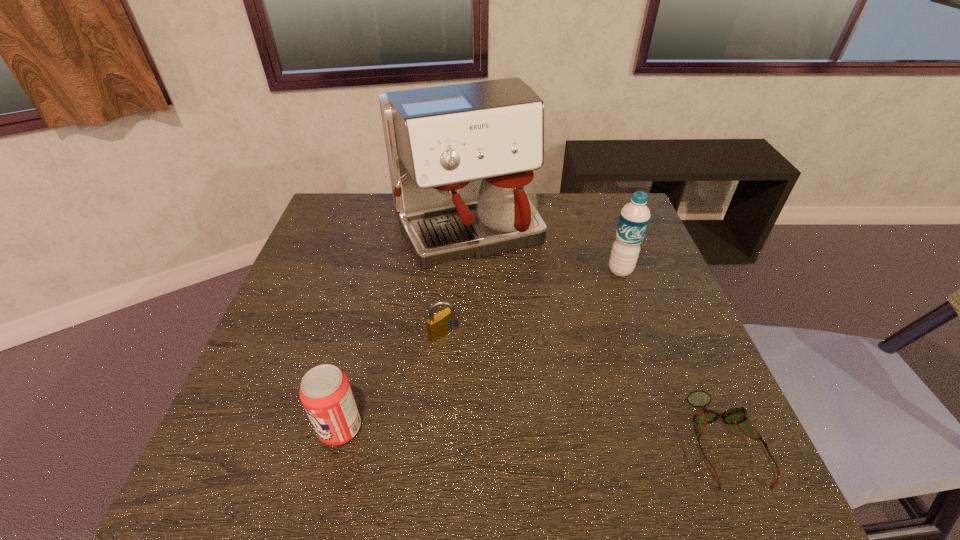
Identify the location of vacant spot on the desktop that is between the third shortest object and the shortest object and is positioned on the label of the fourth shortest object. Image resolution: width=960 pixels, height=540 pixels. (557, 436).

Where is `vacant space on the desktop that is between the soda can and the spectacles and is positioned on the side with the combination dials of the second shortest object`? vacant space on the desktop that is between the soda can and the spectacles and is positioned on the side with the combination dials of the second shortest object is located at coordinates (556, 436).

This screenshot has width=960, height=540. What are the coordinates of `vacant spot on the desktop that is between the third tallest object and the spectacles and is positioned on the front of the coffee maker near the spout` in the screenshot? It's located at (578, 437).